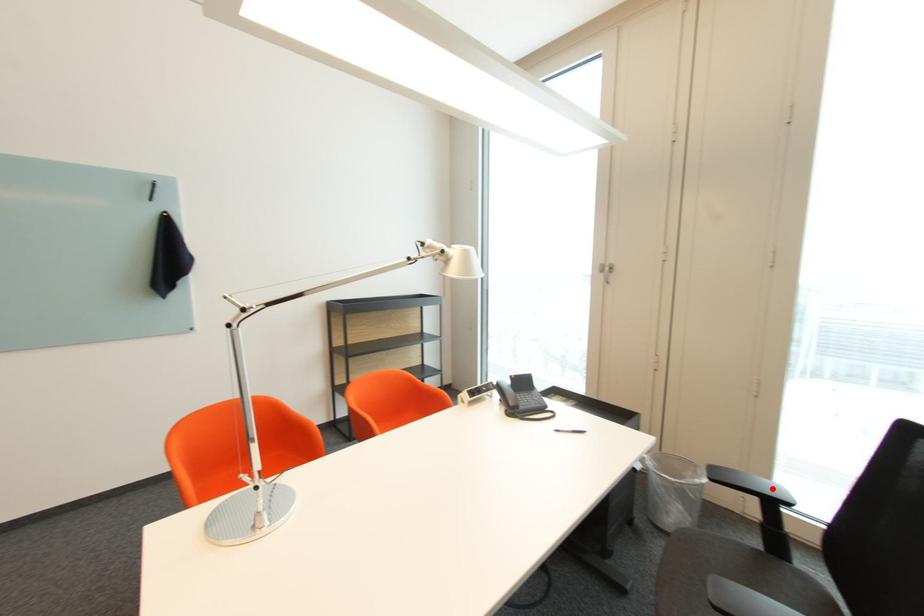
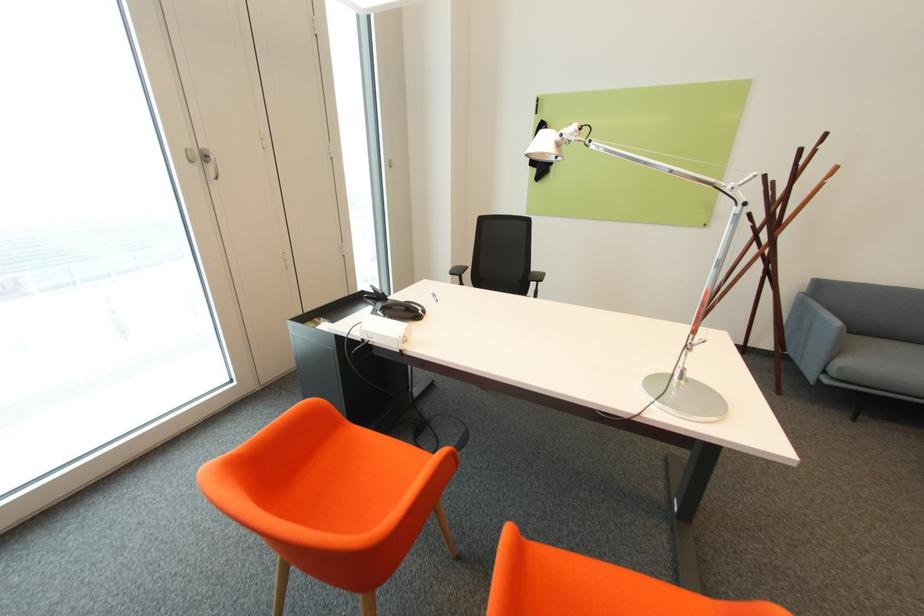
Question: I am providing you with two images of the same scene from different viewpoints. A red point is marked on the first image. Can you still see the location of the red point in image 2?

Choices:
 (A) Yes
 (B) No

Answer: (B)